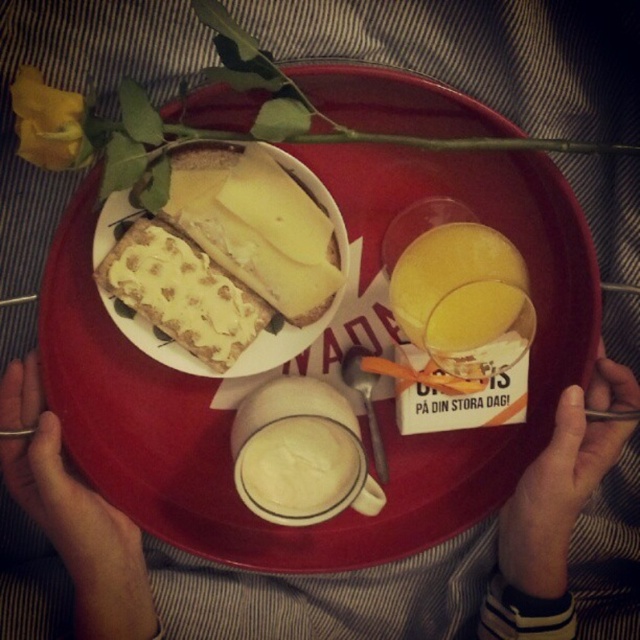
Question: Is white crumbly cheese at upper left thinner than yellow matte juice at center?

Choices:
 (A) yes
 (B) no

Answer: (B)

Question: Which object appears farthest from the camera in this image?

Choices:
 (A) white ceramic mug at center
 (B) white crumbly cheese at upper left
 (C) matte plastic tray at center
 (D) yellow matte juice at center

Answer: (A)

Question: Is white crumbly cheese at upper left to the left of yellow matte juice at center from the viewer's perspective?

Choices:
 (A) yes
 (B) no

Answer: (A)

Question: Does matte plastic tray at center appear over yellow cheese at center?

Choices:
 (A) yes
 (B) no

Answer: (B)

Question: Estimate the real-world distances between objects in this image. Which object is closer to the yellow matte juice at center?

Choices:
 (A) yellow cheese at center
 (B) white ceramic mug at center
 (C) matte plastic tray at center
 (D) white crumbly cheese at upper left

Answer: (A)

Question: Which point is closer to the camera taking this photo?

Choices:
 (A) (256, 296)
 (B) (285, 288)
 (C) (417, 257)

Answer: (C)